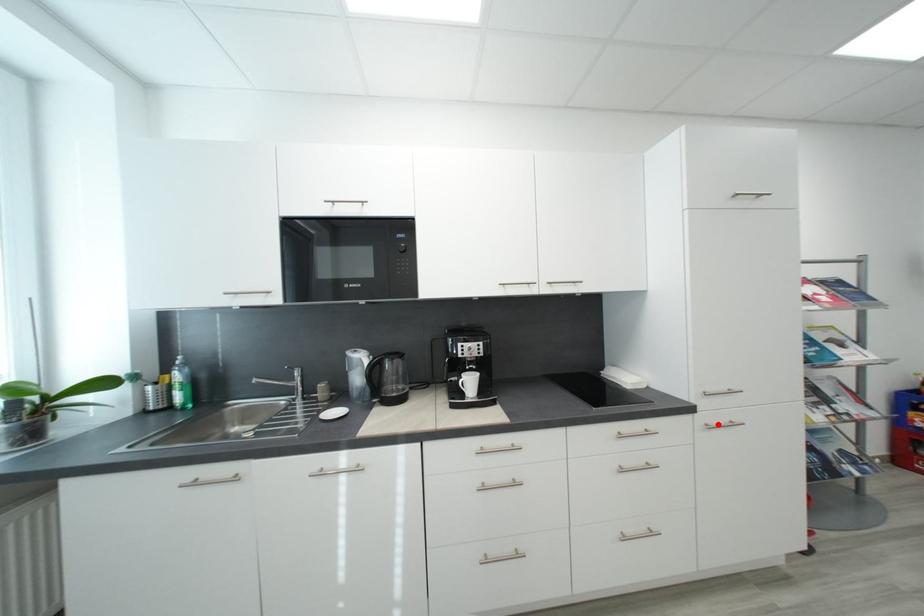
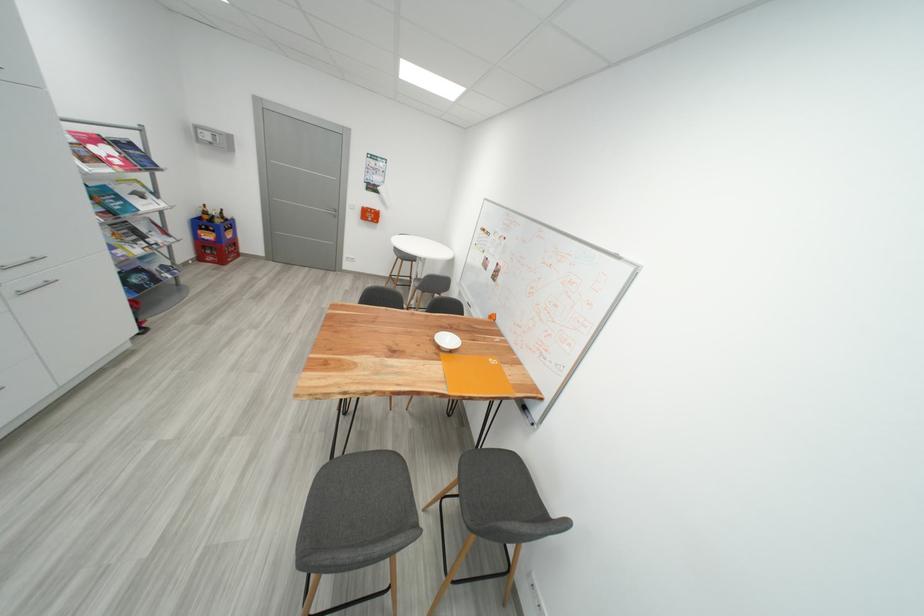
Locate, in the second image, the point that corresponds to the highlighted location in the first image.

(30, 291)